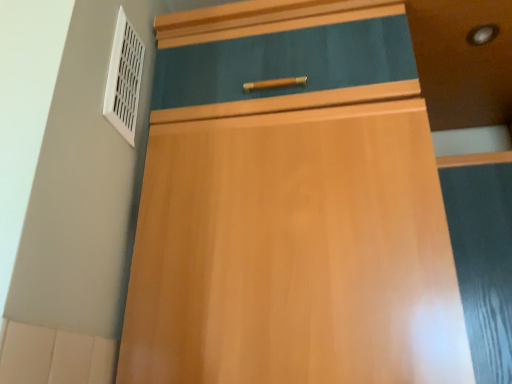
Question: Is point (492, 190) positioned closer to the camera than point (119, 77)?

Choices:
 (A) farther
 (B) closer

Answer: (A)

Question: In terms of size, does matte black screen door at right appear bigger or smaller than white plastic vent at upper left?

Choices:
 (A) big
 (B) small

Answer: (A)

Question: In the image, is matte black screen door at right positioned in front of or behind white plastic vent at upper left?

Choices:
 (A) behind
 (B) front

Answer: (B)

Question: From the image's perspective, is white plastic vent at upper left above or below matte black screen door at right?

Choices:
 (A) above
 (B) below

Answer: (A)

Question: Considering the positions of white plastic vent at upper left and matte black screen door at right in the image, is white plastic vent at upper left taller or shorter than matte black screen door at right?

Choices:
 (A) tall
 (B) short

Answer: (B)

Question: Is point (131, 31) closer or farther from the camera than point (496, 334)?

Choices:
 (A) closer
 (B) farther

Answer: (B)

Question: From a real-world perspective, is white plastic vent at upper left physically located above or below matte black screen door at right?

Choices:
 (A) above
 (B) below

Answer: (A)